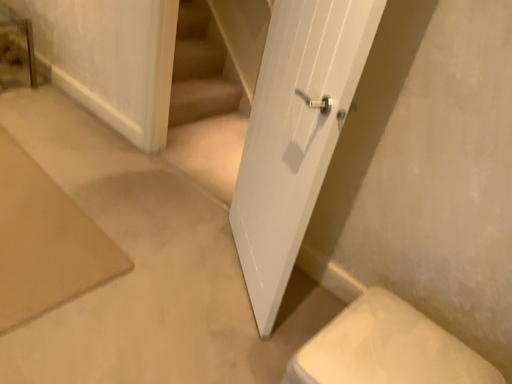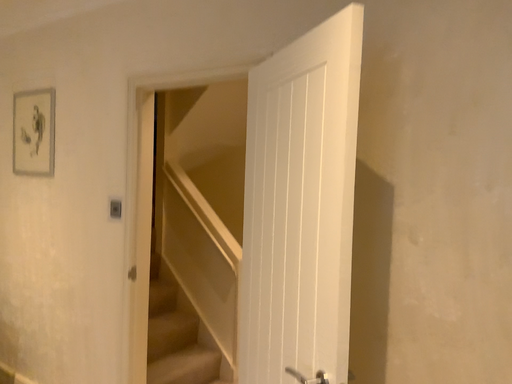
Question: Which way did the camera rotate in the video?

Choices:
 (A) rotated upward
 (B) rotated downward

Answer: (A)